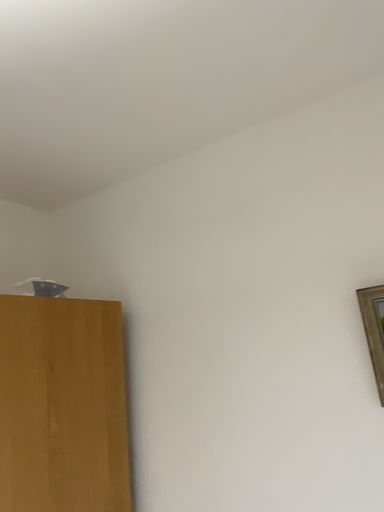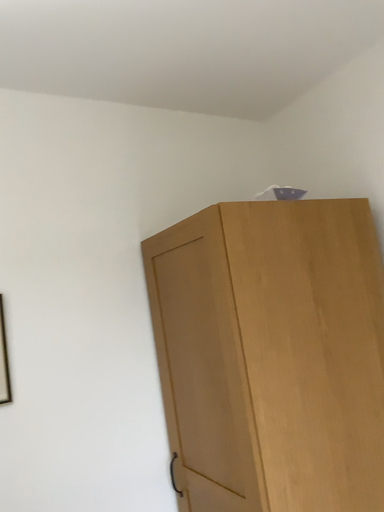
Question: Which way did the camera rotate in the video?

Choices:
 (A) rotated downward
 (B) rotated upward

Answer: (A)